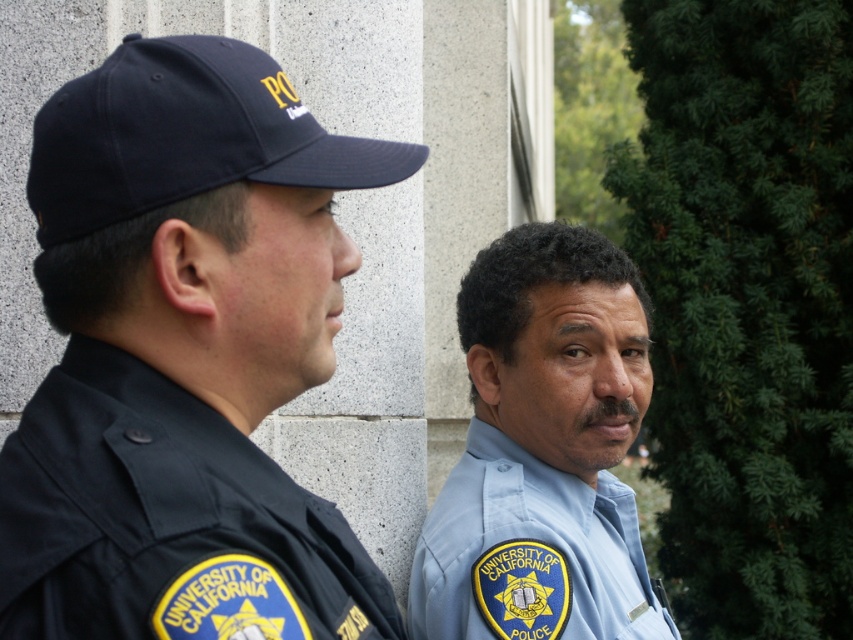
Question: Can you confirm if black fabric uniform at left is thinner than navy blue fabric baseball cap at left?

Choices:
 (A) yes
 (B) no

Answer: (A)

Question: Observing the image, what is the correct spatial positioning of black fabric uniform at left in reference to light blue uniform at center?

Choices:
 (A) left
 (B) right

Answer: (A)

Question: Can you confirm if black fabric uniform at left is bigger than light blue uniform at center?

Choices:
 (A) no
 (B) yes

Answer: (A)

Question: Which is farther from the light blue uniform at center?

Choices:
 (A) black fabric uniform at left
 (B) navy blue fabric baseball cap at left

Answer: (B)

Question: Which point is closer to the camera?

Choices:
 (A) black fabric uniform at left
 (B) dark blue uniform at left
 (C) navy blue fabric baseball cap at left

Answer: (A)

Question: Which point is closer to the camera?

Choices:
 (A) dark blue uniform at left
 (B) light blue uniform at center
 (C) navy blue fabric baseball cap at left
 (D) black fabric uniform at left

Answer: (D)